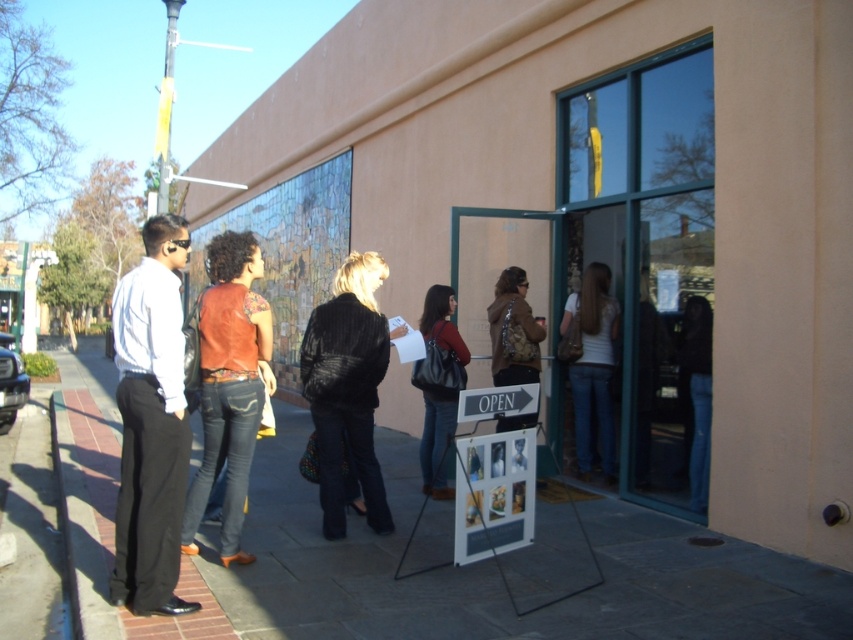
Who is positioned more to the right, paved stone sidewalk at lower left or denim jeans at center?

denim jeans at center is more to the right.

Can you confirm if paved stone sidewalk at lower left is wider than denim jeans at center?

Correct, the width of paved stone sidewalk at lower left exceeds that of denim jeans at center.

Locate an element on the screen. This screenshot has height=640, width=853. paved stone sidewalk at lower left is located at coordinates (496, 572).

Locate an element on the screen. paved stone sidewalk at lower left is located at coordinates (496, 572).

Who is taller, paved stone sidewalk at lower left or jeans at center?

Standing taller between the two is jeans at center.

What do you see at coordinates (496, 572) in the screenshot? Image resolution: width=853 pixels, height=640 pixels. I see `paved stone sidewalk at lower left` at bounding box center [496, 572].

Image resolution: width=853 pixels, height=640 pixels. I want to click on paved stone sidewalk at lower left, so click(x=496, y=572).

Can you confirm if paved stone sidewalk at lower left is positioned to the right of leather jacket at center?

In fact, paved stone sidewalk at lower left is to the left of leather jacket at center.

Locate an element on the screen. paved stone sidewalk at lower left is located at coordinates click(496, 572).

You are a GUI agent. You are given a task and a screenshot of the screen. Output one action in this format:
    pyautogui.click(x=<x>, y=<y>)
    Task: Click on the paved stone sidewalk at lower left
    
    Given the screenshot: What is the action you would take?
    pyautogui.click(x=496, y=572)